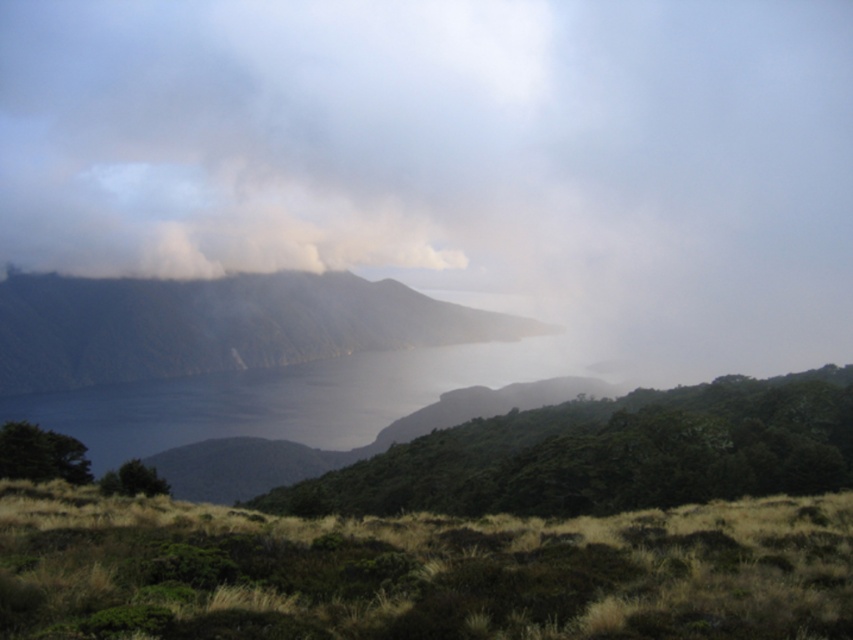
You are a hiker standing at point [9,598] and want to reach point [144,96]. According to the scene description, which direction should you move to get closer to your destination?

Since point [144,96] is behind point [9,598], you should move backward to reach it.

You are a hiker planning to cross from the white foggy cloud at upper center to the dark gray rocky mountain at center. Which path would require ascending or descending more steeply?

The path to the dark gray rocky mountain at center requires ascending or descending more steeply because it is farther away from the viewer, implying a steeper incline or decline compared to the closer white foggy cloud at upper center.

You are a hiker standing at the point labeled as point (x=457, y=163) in the image. You want to descend to the volcanic crater lake below. Which direction should you move to reach the lake?

The white foggy cloud at upper center is located at point (x=457, y=163). Since the lake is in the foreground and the cloud is at upper center, you should move downward from the point to reach the lake.